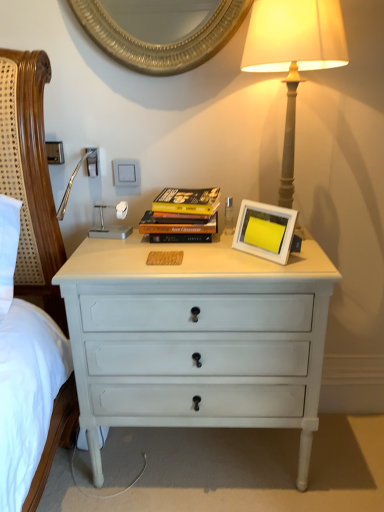
Question: Is hardcover books at center positioned beyond the bounds of white painted wood chest of drawers at center?

Choices:
 (A) no
 (B) yes

Answer: (B)

Question: Is hardcover books at center aimed at white painted wood chest of drawers at center?

Choices:
 (A) yes
 (B) no

Answer: (B)

Question: From the image's perspective, would you say hardcover books at center is shown under white painted wood chest of drawers at center?

Choices:
 (A) yes
 (B) no

Answer: (B)

Question: Can you see hardcover books at center touching white painted wood chest of drawers at center?

Choices:
 (A) yes
 (B) no

Answer: (B)

Question: Is hardcover books at center positioned with its back to white painted wood chest of drawers at center?

Choices:
 (A) no
 (B) yes

Answer: (A)

Question: From a real-world perspective, is hardcover books at center positioned above or below matte gray lamp at upper right?

Choices:
 (A) below
 (B) above

Answer: (A)

Question: From the image's perspective, is hardcover books at center above or below matte gray lamp at upper right?

Choices:
 (A) above
 (B) below

Answer: (B)

Question: Is hardcover books at center situated inside matte gray lamp at upper right or outside?

Choices:
 (A) outside
 (B) inside

Answer: (A)

Question: Would you say hardcover books at center is to the left or to the right of matte gray lamp at upper right in the picture?

Choices:
 (A) left
 (B) right

Answer: (A)

Question: From a real-world perspective, relative to white matte picture frame at center, is hardcover books at center vertically above or below?

Choices:
 (A) below
 (B) above

Answer: (B)

Question: In terms of width, does hardcover books at center look wider or thinner when compared to white matte picture frame at center?

Choices:
 (A) wide
 (B) thin

Answer: (A)

Question: Is hardcover books at center bigger or smaller than white matte picture frame at center?

Choices:
 (A) big
 (B) small

Answer: (A)

Question: Considering their positions, is hardcover books at center located in front of or behind white matte picture frame at center?

Choices:
 (A) behind
 (B) front

Answer: (A)

Question: Considering the positions of white matte picture frame at center and matte gray lamp at upper right in the image, is white matte picture frame at center taller or shorter than matte gray lamp at upper right?

Choices:
 (A) tall
 (B) short

Answer: (B)

Question: From the image's perspective, is white matte picture frame at center positioned above or below matte gray lamp at upper right?

Choices:
 (A) below
 (B) above

Answer: (A)